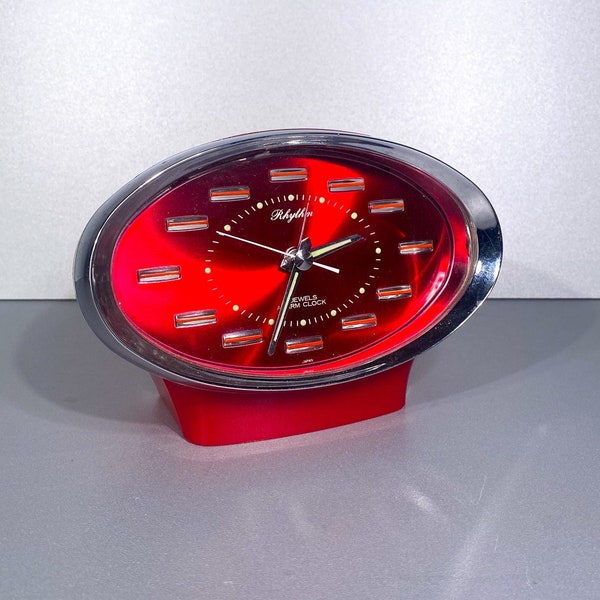
The image size is (600, 600). Find the location of `clock`. clock is located at coordinates (319, 302).